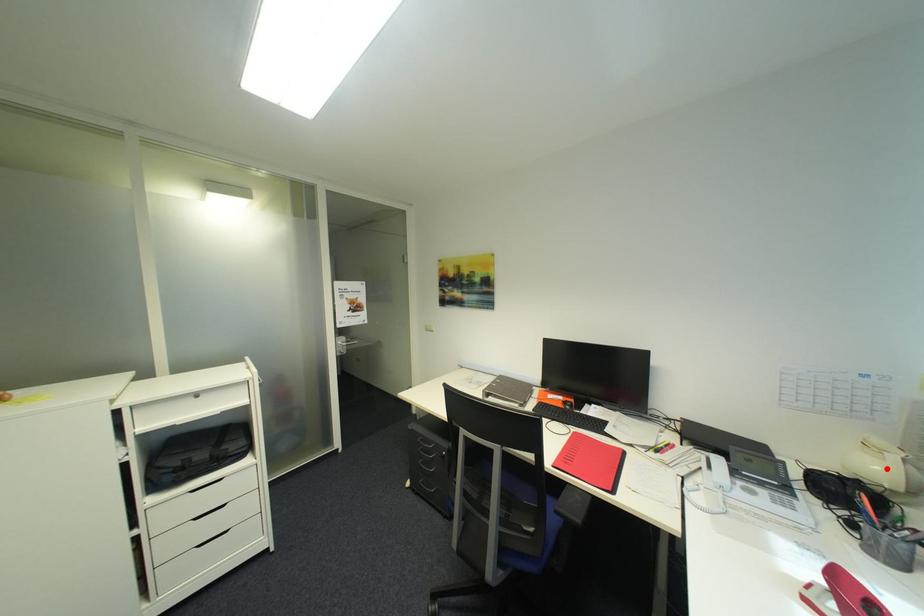
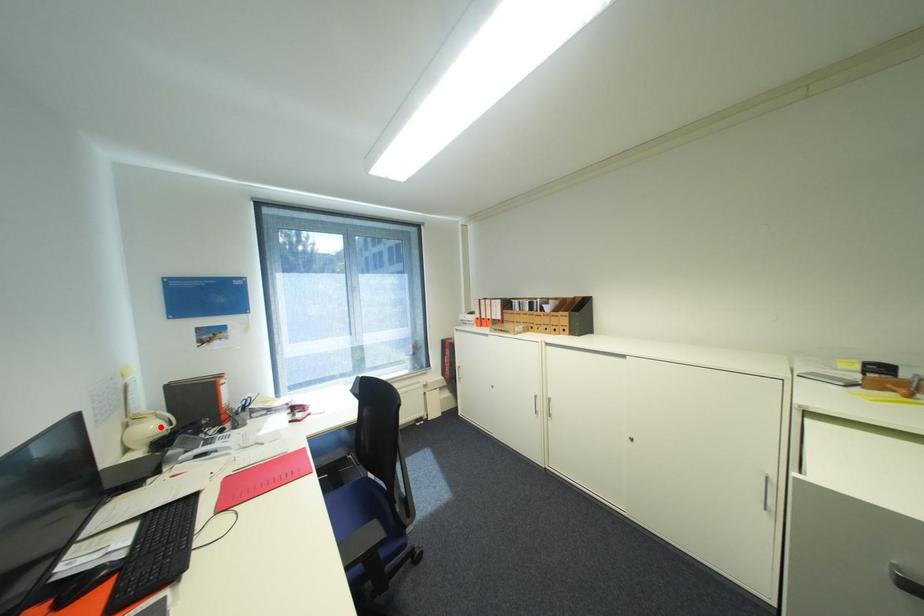
I am providing you with two images of the same scene from different viewpoints. A red point is marked on the first image and another point is marked on the second image. Is the marked point in image1 the same physical position as the marked point in image2?

Yes